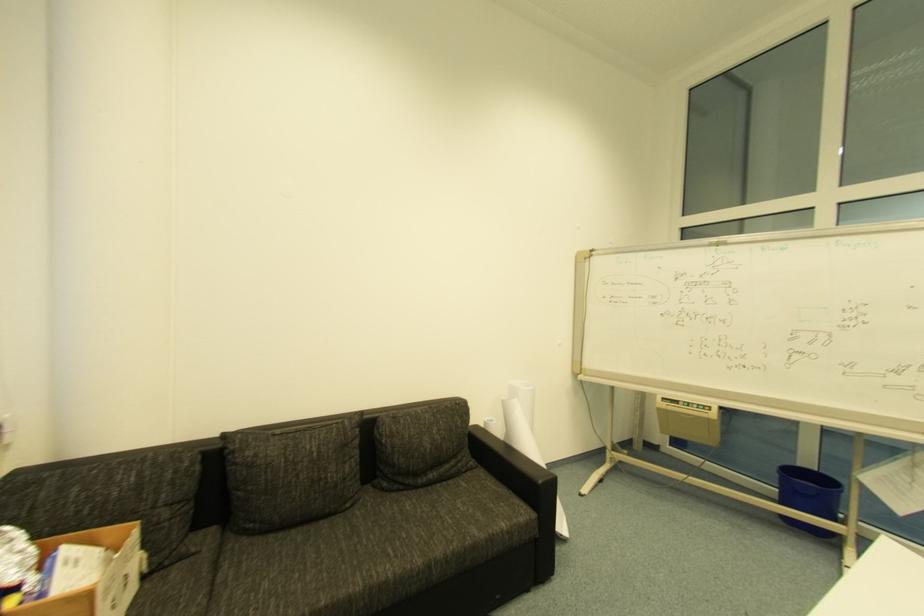
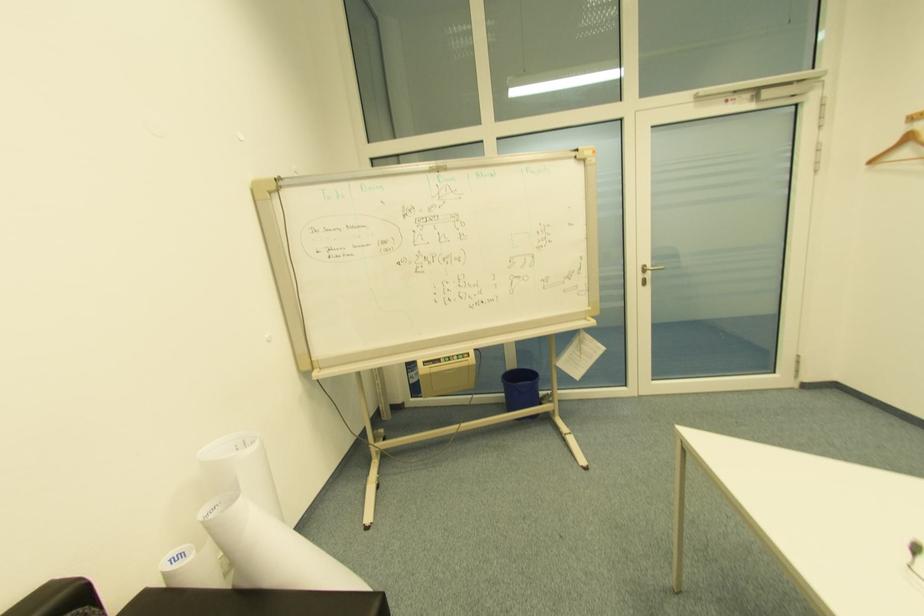
Question: The camera is either moving clockwise (left) or counter-clockwise (right) around the object. The first image is from the beginning of the video and the second image is from the end. Is the camera moving left or right when shooting the video?

Choices:
 (A) Left
 (B) Right

Answer: (A)